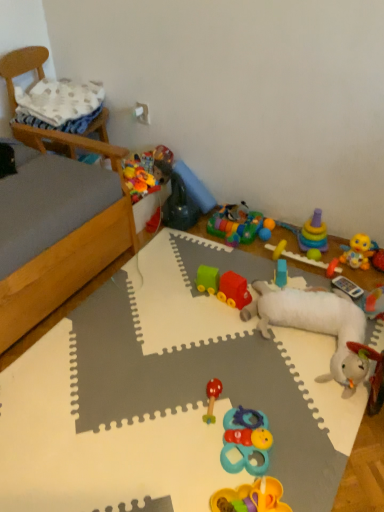
In order to click on vacant space underneath wooden table at center (from a real-world perspective) in this screenshot , I will do `click(167, 401)`.